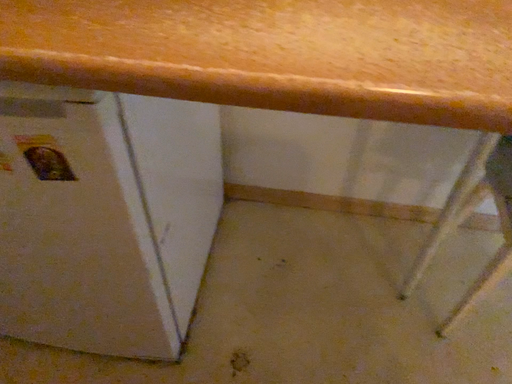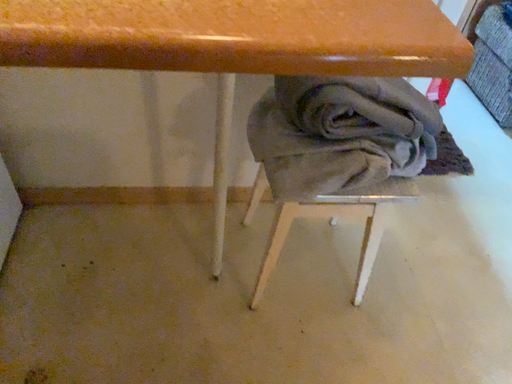
Question: How did the camera likely rotate when shooting the video?

Choices:
 (A) rotated left
 (B) rotated right

Answer: (B)